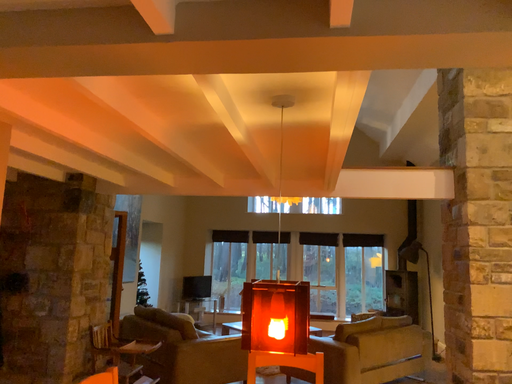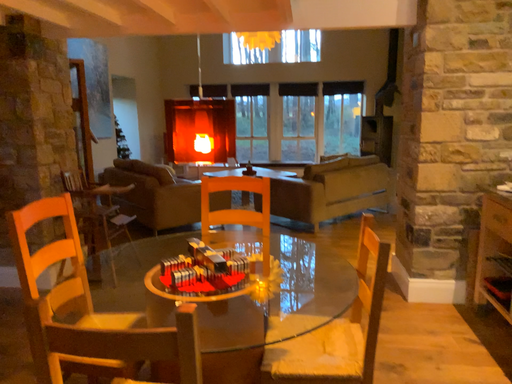
Question: Which way did the camera rotate in the video?

Choices:
 (A) rotated upward
 (B) rotated downward

Answer: (B)